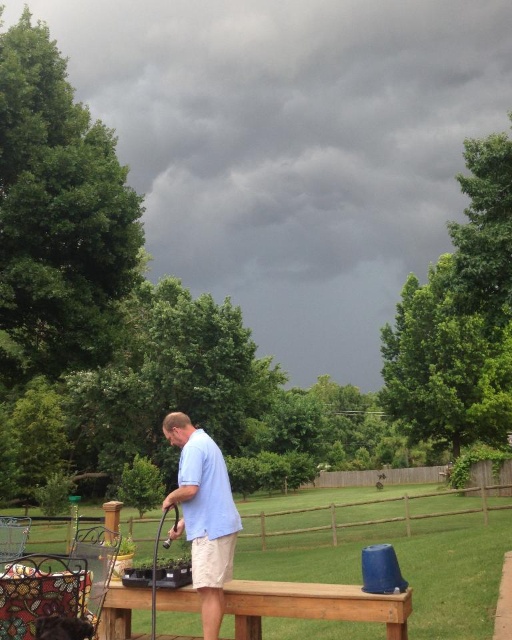
Who is lower down, brown wooden picnic table at center or light blue shirt at center?

brown wooden picnic table at center

Does brown wooden picnic table at center have a smaller size compared to light blue shirt at center?

Correct, brown wooden picnic table at center occupies less space than light blue shirt at center.

Between point (111, 621) and point (172, 444), which one is positioned in front?

Point (111, 621) is more forward.

The width and height of the screenshot is (512, 640). What are the coordinates of `brown wooden picnic table at center` in the screenshot? It's located at pos(312,605).